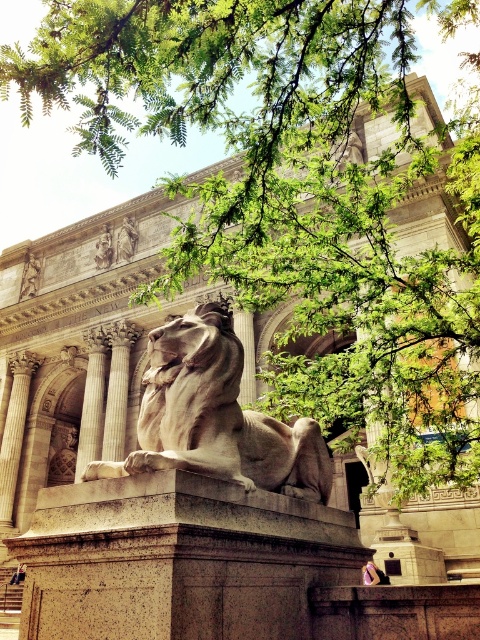
Question: Among these objects, which one is farthest from the camera?

Choices:
 (A) white marble column at center
 (B) white stone lion at center

Answer: (A)

Question: Is beige stone column at left wider than gray stone column at center?

Choices:
 (A) no
 (B) yes

Answer: (B)

Question: Which of the following is the farthest from the observer?

Choices:
 (A) beige stone column at left
 (B) white marble column at center

Answer: (B)

Question: Which is farther from the gray stone column at center?

Choices:
 (A) beige stone column at left
 (B) white marble column at center
 (C) white stone lion at center

Answer: (C)

Question: Observing the image, what is the correct spatial positioning of white marble column at center in reference to beige stone column at left?

Choices:
 (A) above
 (B) below

Answer: (B)

Question: Is white stone lion at center closer to camera compared to gray stone column at center?

Choices:
 (A) yes
 (B) no

Answer: (A)